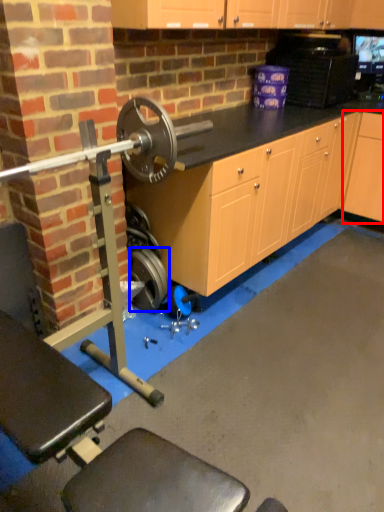
Question: Which object is closer to the camera taking this photo, cabinetry (highlighted by a red box) or wheel (highlighted by a blue box)?

Choices:
 (A) cabinetry
 (B) wheel

Answer: (B)